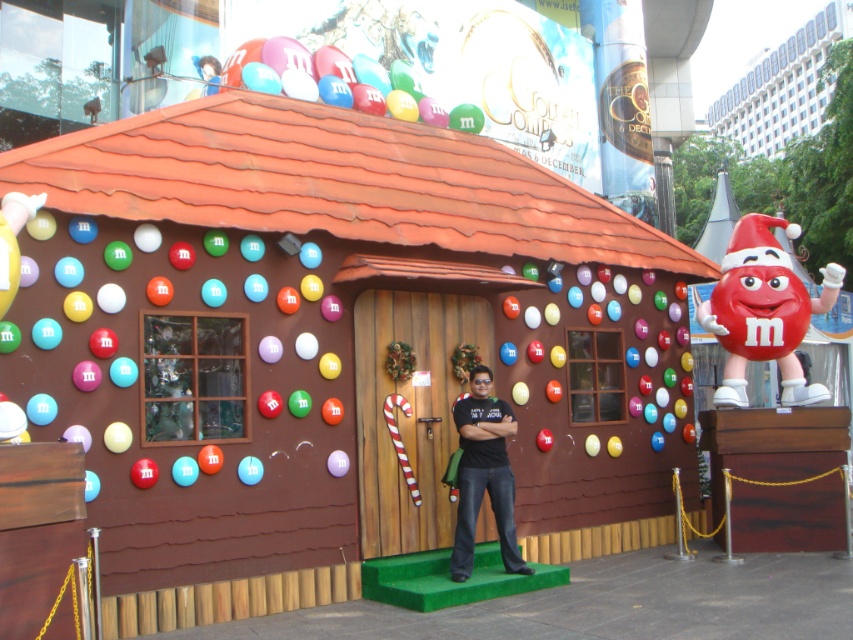
Can you confirm if brown cardboard hut at center is shorter than smooth red candy at right?

Yes.

Does point (177, 493) come farther from viewer compared to point (793, 356)?

No, it is in front of (793, 356).

Does point (596, 406) lie behind point (743, 396)?

Yes, point (596, 406) is farther from viewer.

I want to click on brown cardboard hut at center, so click(x=329, y=346).

Is point (762, 317) more distant than point (752, 125)?

No, it is not.

Which is more to the left, smooth red candy at right or white glass building at upper right?

From the viewer's perspective, smooth red candy at right appears more on the left side.

At what (x,y) coordinates should I click in order to perform the action: click on smooth red candy at right. Please return your answer as a coordinate pair (x, y). This screenshot has width=853, height=640. Looking at the image, I should click on (763, 310).

Which is above, white glass building at upper right or shiny plastic balloon at upper center?

white glass building at upper right is higher up.

Who is more distant from viewer, (770, 140) or (343, 106)?

The point (770, 140) is behind.

Which is behind, point (758, 125) or point (358, 97)?

Point (758, 125)

Where is `white glass building at upper right`? The height and width of the screenshot is (640, 853). white glass building at upper right is located at coordinates (782, 86).